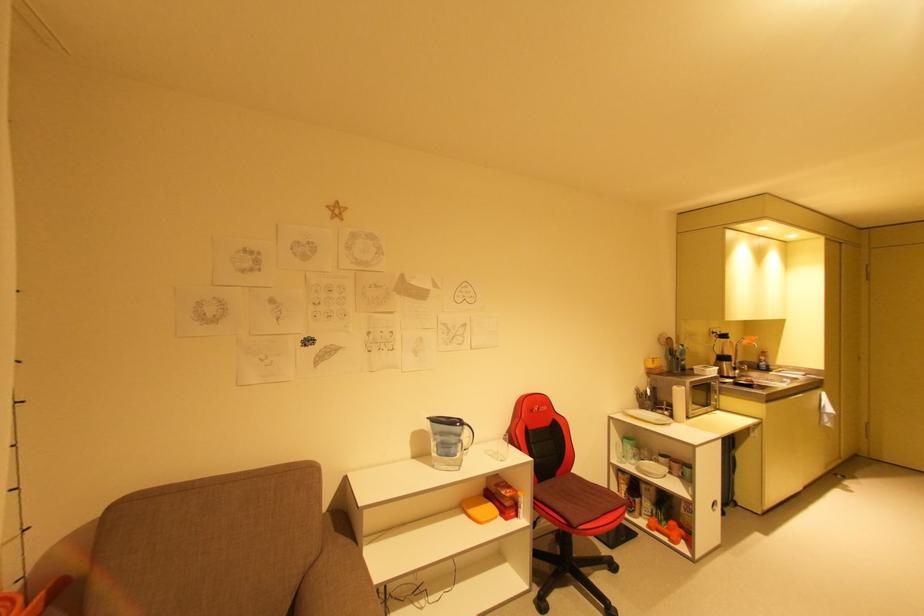
Find where to rest the sofa armrest. Please return your answer as a coordinate pair (x, y).

(336, 578)